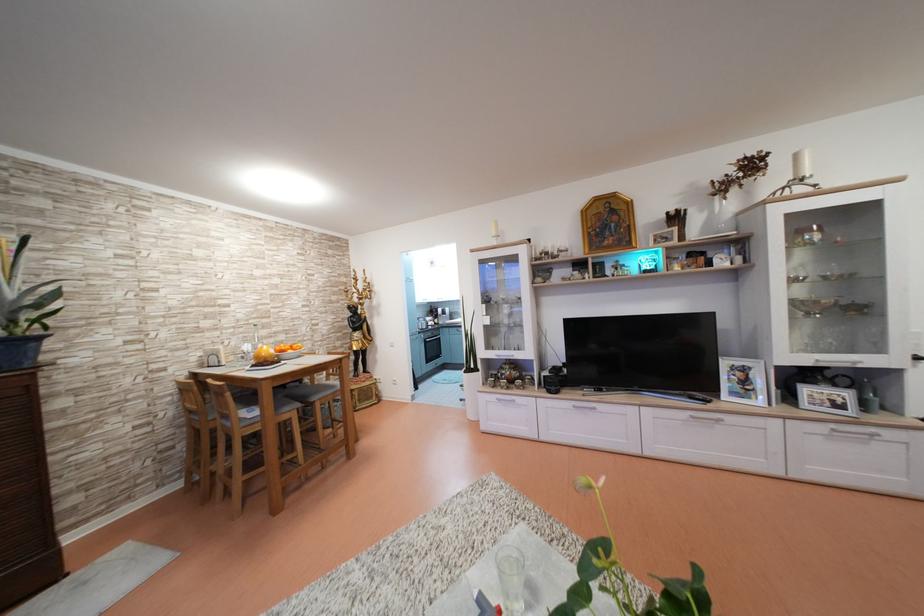
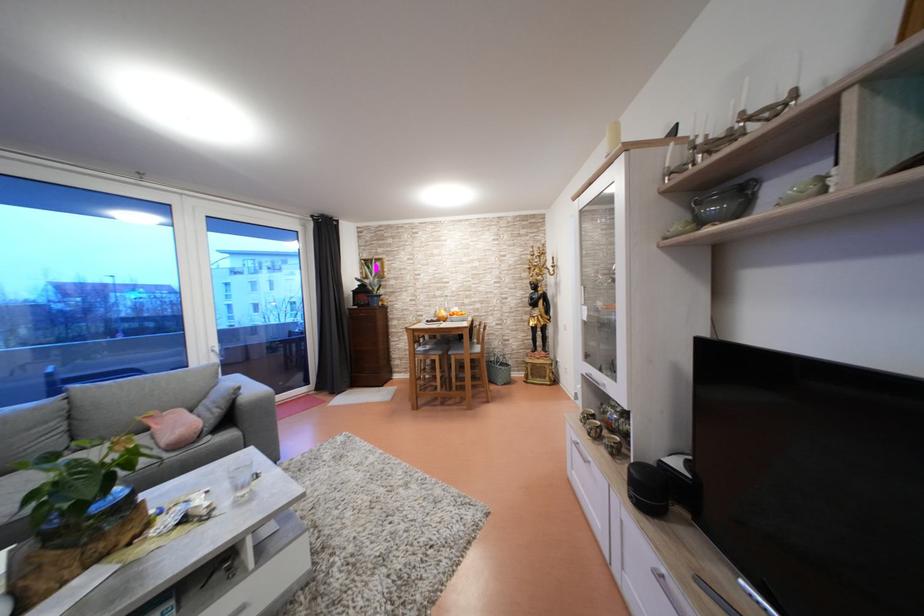
The point at [213,329] is marked in the first image. Where is the corresponding point in the second image?

(444, 299)